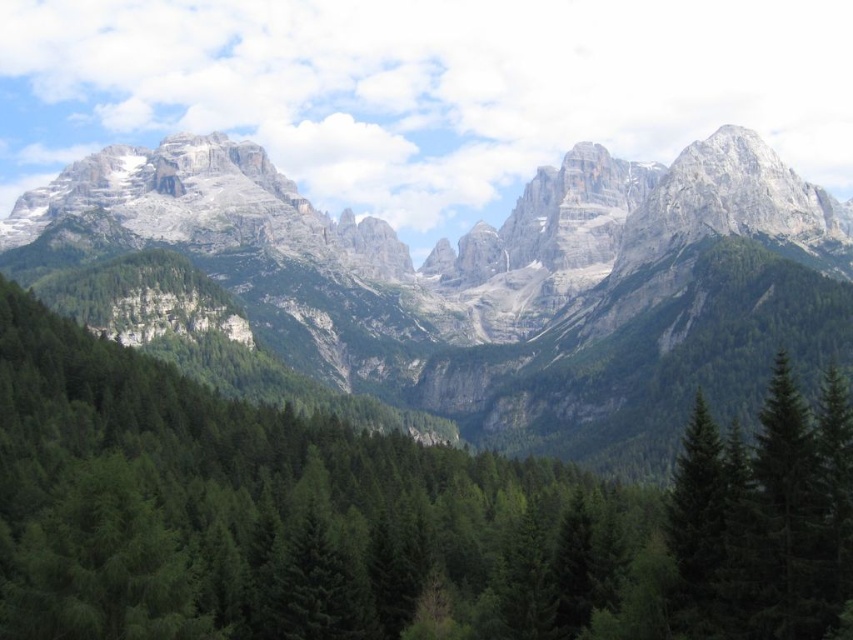
Question: Can you confirm if green matte tree at center is positioned above gray rock mountain range at upper center?

Choices:
 (A) yes
 (B) no

Answer: (B)

Question: Does green matte tree at center appear over gray rock mountain range at upper center?

Choices:
 (A) no
 (B) yes

Answer: (A)

Question: Which of the following is the farthest from the observer?

Choices:
 (A) (671, 554)
 (B) (703, 289)

Answer: (B)

Question: Observing the image, what is the correct spatial positioning of green matte tree at center in reference to gray rock mountain range at upper center?

Choices:
 (A) above
 (B) below

Answer: (B)

Question: Among these points, which one is nearest to the camera?

Choices:
 (A) (529, 545)
 (B) (850, 304)

Answer: (A)